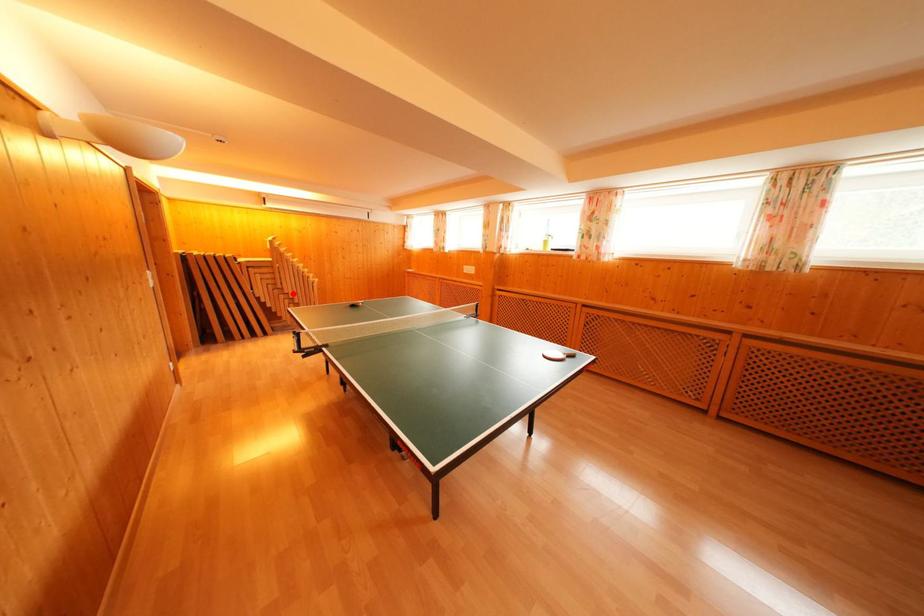
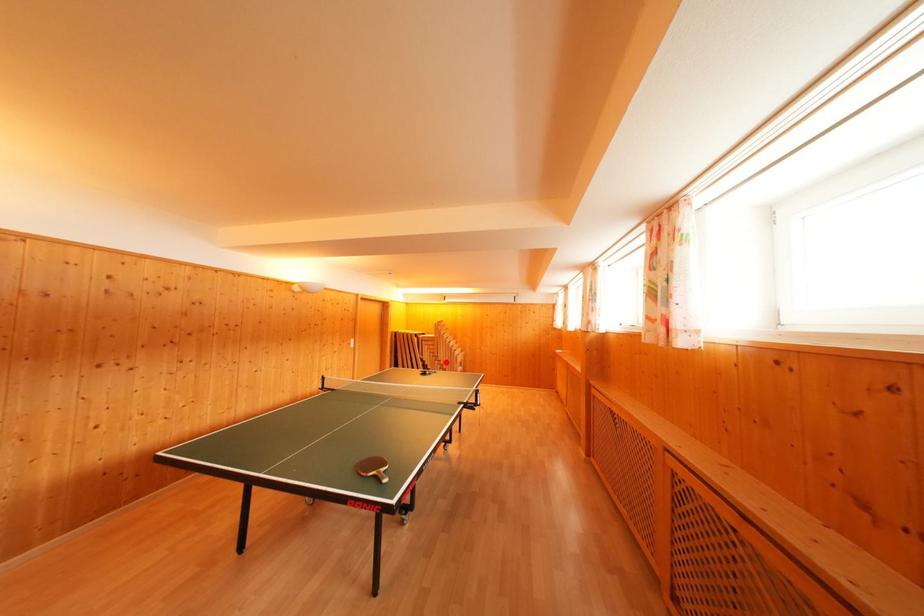
I am providing you with two images of the same scene from different viewpoints. A red point is marked on the first image and another point is marked on the second image. Does the point marked in image1 correspond to the same location as the one in image2?

Yes